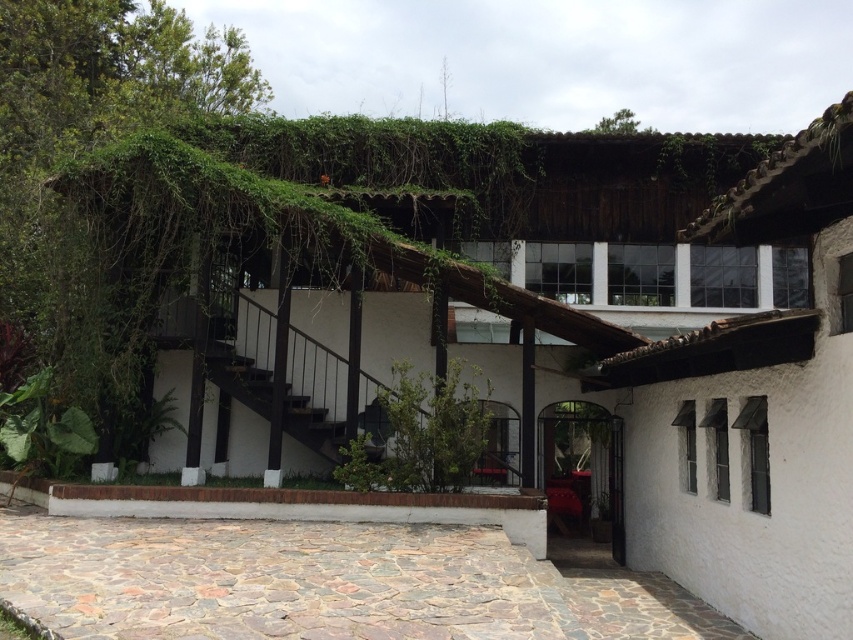
Question: Where is green leafy plant at lower left located in relation to black wooden stairs at center in the image?

Choices:
 (A) below
 (B) above

Answer: (A)

Question: Which point is closer to the camera?

Choices:
 (A) (335, 456)
 (B) (386, 400)

Answer: (B)

Question: In this image, where is green leafy plant at center located relative to green leafy plant at lower left?

Choices:
 (A) left
 (B) right

Answer: (B)

Question: Which object appears closest to the camera in this image?

Choices:
 (A) green leafy plant at center
 (B) black wooden stairs at center
 (C) green leafy plant at lower left

Answer: (A)

Question: Which object is positioned farthest from the green leafy plant at lower left?

Choices:
 (A) green leafy plant at center
 (B) black wooden stairs at center

Answer: (A)

Question: Is green leafy plant at center thinner than black wooden stairs at center?

Choices:
 (A) no
 (B) yes

Answer: (A)